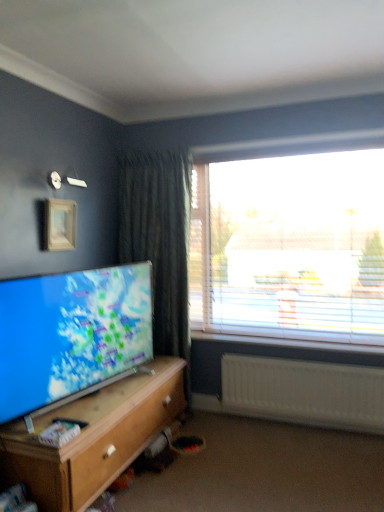
Find the location of `unoccupied region to the right of black plastic remote control at lower left`. unoccupied region to the right of black plastic remote control at lower left is located at coordinates (102, 420).